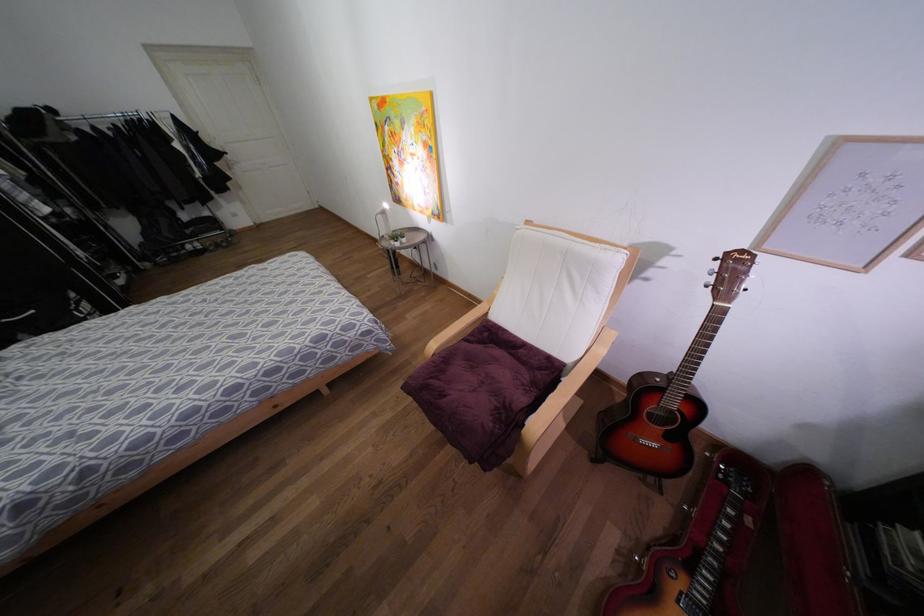
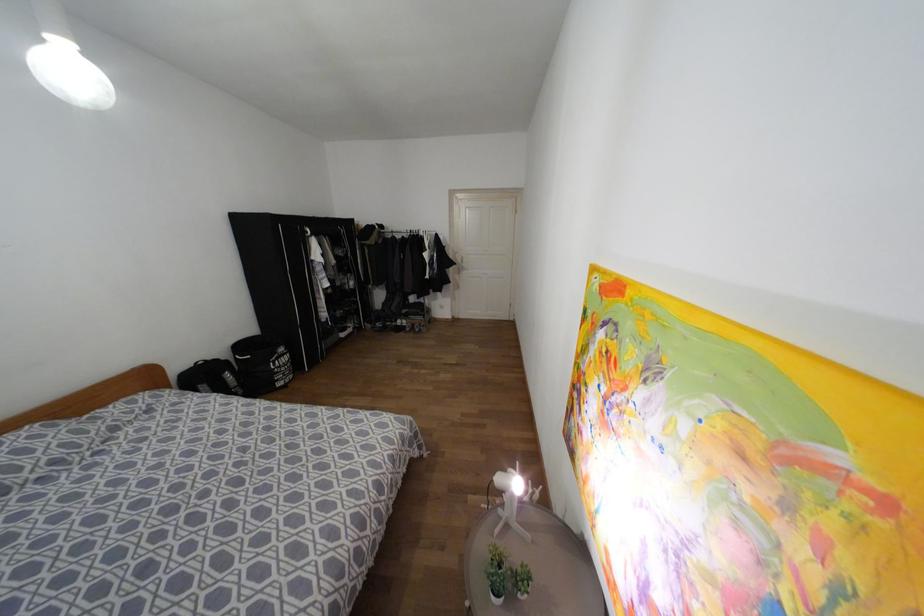
In the second image, find the point that corresponds to [71,294] in the first image.

(281, 349)